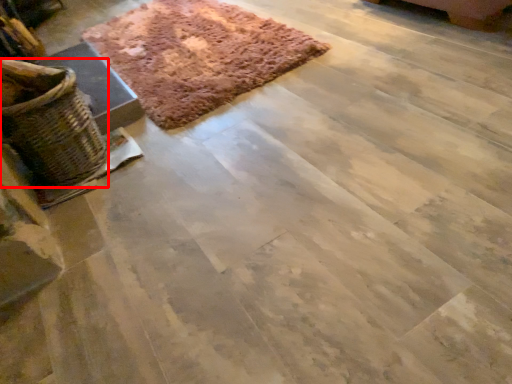
Question: In this image, where is basket (annotated by the red box) located relative to mat?

Choices:
 (A) right
 (B) left

Answer: (B)